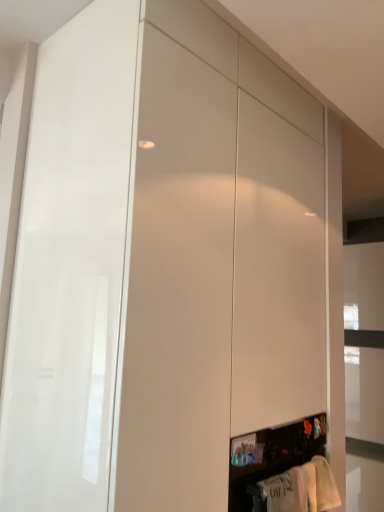
Question: Should I look upward or downward to see white cotton shirt at lower right, the first clothing in the left-to-right sequence?

Choices:
 (A) up
 (B) down

Answer: (B)

Question: From the image's perspective, is white cotton towel at lower right, acting as the 2th clothing starting from the left, above white cotton shirt at lower right, the first clothing in the left-to-right sequence?

Choices:
 (A) no
 (B) yes

Answer: (A)

Question: Does white cotton towel at lower right, acting as the 2th clothing starting from the left, have a larger size compared to white cotton shirt at lower right, the first clothing positioned from the front?

Choices:
 (A) no
 (B) yes

Answer: (A)

Question: From a real-world perspective, does white cotton towel at lower right, acting as the 2th clothing starting from the left, sit lower than white cotton shirt at lower right, which ranks as the second clothing in right-to-left order?

Choices:
 (A) yes
 (B) no

Answer: (B)

Question: Is white cotton towel at lower right, positioned as the 2th clothing in front-to-back order, positioned beyond the bounds of white cotton shirt at lower right, the first clothing in the left-to-right sequence?

Choices:
 (A) no
 (B) yes

Answer: (B)

Question: From the image's perspective, does white cotton towel at lower right, acting as the 2th clothing starting from the left, appear lower than white cotton shirt at lower right, the 2th clothing when ordered from back to front?

Choices:
 (A) yes
 (B) no

Answer: (A)

Question: Could white cotton shirt at lower right, the 2th clothing when ordered from back to front, be considered to be inside white cotton towel at lower right, acting as the 2th clothing starting from the left?

Choices:
 (A) yes
 (B) no

Answer: (B)

Question: Considering the relative positions of white cotton shirt at lower right, the 2th clothing when ordered from back to front, and white cotton towel at lower right, positioned as the 2th clothing in front-to-back order, in the image provided, is white cotton shirt at lower right, the 2th clothing when ordered from back to front, in front of white cotton towel at lower right, positioned as the 2th clothing in front-to-back order,?

Choices:
 (A) yes
 (B) no

Answer: (A)

Question: From the image's perspective, is white cotton shirt at lower right, the first clothing in the left-to-right sequence, on top of white cotton towel at lower right, placed as the 1th clothing when sorted from right to left?

Choices:
 (A) no
 (B) yes

Answer: (B)

Question: Is white cotton shirt at lower right, the 2th clothing when ordered from back to front, smaller than white cotton towel at lower right, acting as the 2th clothing starting from the left?

Choices:
 (A) yes
 (B) no

Answer: (B)

Question: From a real-world perspective, is white cotton shirt at lower right, which ranks as the second clothing in right-to-left order, positioned over white cotton towel at lower right, which is the 1th clothing from back to front, based on gravity?

Choices:
 (A) yes
 (B) no

Answer: (B)

Question: Considering the relative sizes of white cotton shirt at lower right, the first clothing in the left-to-right sequence, and white cotton towel at lower right, acting as the 2th clothing starting from the left, in the image provided, is white cotton shirt at lower right, the first clothing in the left-to-right sequence, shorter than white cotton towel at lower right, acting as the 2th clothing starting from the left,?

Choices:
 (A) yes
 (B) no

Answer: (B)

Question: Considering the relative positions of white cotton shirt at lower right, the first clothing positioned from the front, and white cotton towel at lower right, positioned as the 2th clothing in front-to-back order, in the image provided, is white cotton shirt at lower right, the first clothing positioned from the front, to the right of white cotton towel at lower right, positioned as the 2th clothing in front-to-back order, from the viewer's perspective?

Choices:
 (A) yes
 (B) no

Answer: (B)

Question: Is white cotton towel at lower right, positioned as the 2th clothing in front-to-back order, bigger or smaller than white cotton shirt at lower right, which ranks as the second clothing in right-to-left order?

Choices:
 (A) big
 (B) small

Answer: (B)